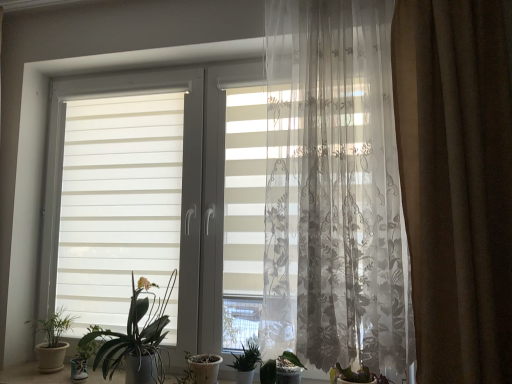
Question: Is green matte plant at lower left, placed as the 4th houseplant when sorted from right to left, in front of or behind green matte plant at center, the 2th houseplant viewed from the left, in the image?

Choices:
 (A) front
 (B) behind

Answer: (B)

Question: Is green matte plant at lower left, the 1th houseplant in the left-to-right sequence, spatially inside green matte plant at center, the 3th houseplant positioned from the right, or outside of it?

Choices:
 (A) inside
 (B) outside

Answer: (B)

Question: Which object is positioned closest to the green matte plant at lower left, placed as the 4th houseplant when sorted from right to left?

Choices:
 (A) sheer floral-patterned curtain at center, acting as the second curtain starting from the right
 (B) green matte leafy plant at lower center, the 1th houseplant from the right
 (C) green matte plant at center, the 3th houseplant positioned from the right
 (D) brown velvet curtain at right, the first curtain positioned from the right
 (E) green leafy plant at center, which is the 3th houseplant in left-to-right order

Answer: (C)

Question: Considering the real-world distances, which object is farthest from the sheer floral-patterned curtain at center, acting as the second curtain starting from the right?

Choices:
 (A) green matte leafy plant at lower center, the 1th houseplant from the right
 (B) brown velvet curtain at right, which appears as the 2th curtain when viewed from the left
 (C) white striped window at center
 (D) green matte plant at center, the 2th houseplant viewed from the left
 (E) green leafy plant at center, which is the 3th houseplant in left-to-right order

Answer: (D)